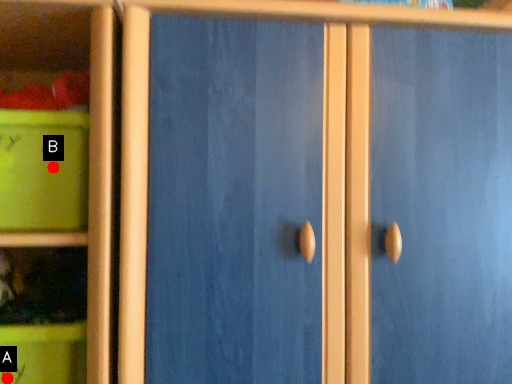
Question: Two points are circled on the image, labeled by A and B beside each circle. Which point appears closest to the camera in this image?

Choices:
 (A) A is closer
 (B) B is closer

Answer: (A)